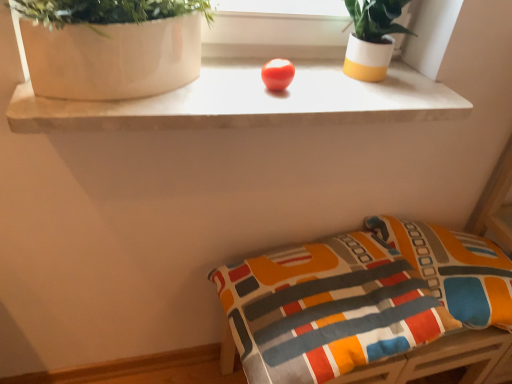
Identify the location of vacant space that's between white glossy vase at upper left and white/yellow ceramic pot at upper right. (289, 83).